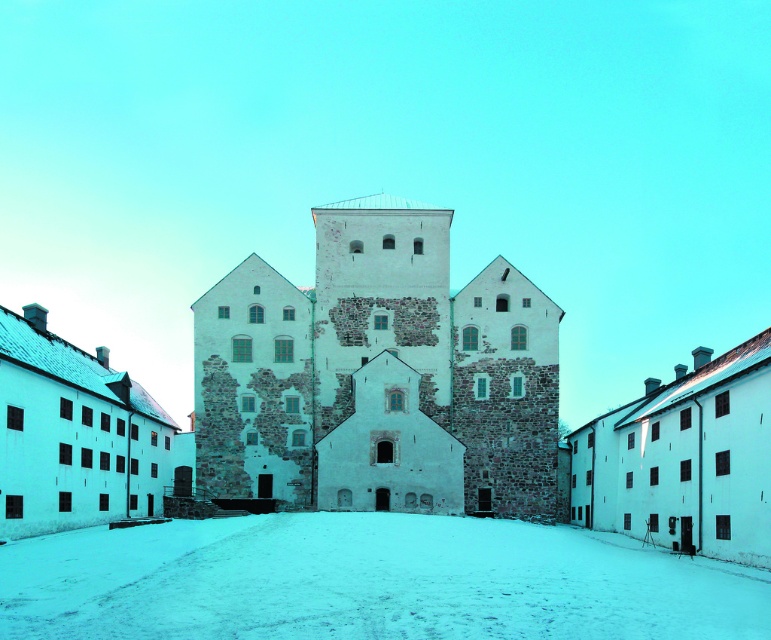
Question: Which point is closer to the camera?

Choices:
 (A) (194, 609)
 (B) (436, 371)

Answer: (A)

Question: Does white stone tower at center appear on the left side of white powdery snow at center?

Choices:
 (A) yes
 (B) no

Answer: (B)

Question: Does white stone tower at center appear on the right side of white powdery snow at center?

Choices:
 (A) yes
 (B) no

Answer: (A)

Question: Among these objects, which one is nearest to the camera?

Choices:
 (A) white powdery snow at center
 (B) white stone tower at center

Answer: (A)

Question: Is white stone tower at center wider than white powdery snow at center?

Choices:
 (A) yes
 (B) no

Answer: (B)

Question: Which point is farther from the camera taking this photo?

Choices:
 (A) (328, 296)
 (B) (285, 545)

Answer: (A)